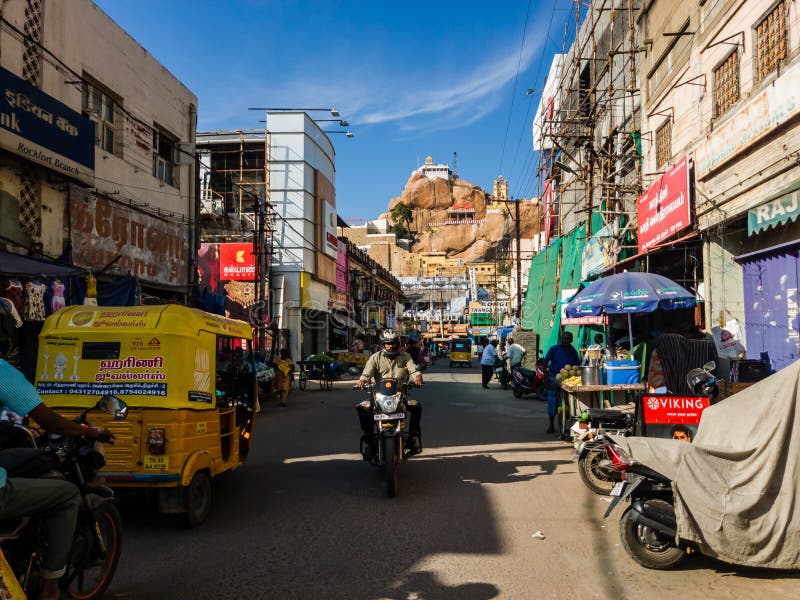
The width and height of the screenshot is (800, 600). I want to click on mirror, so click(x=114, y=405).